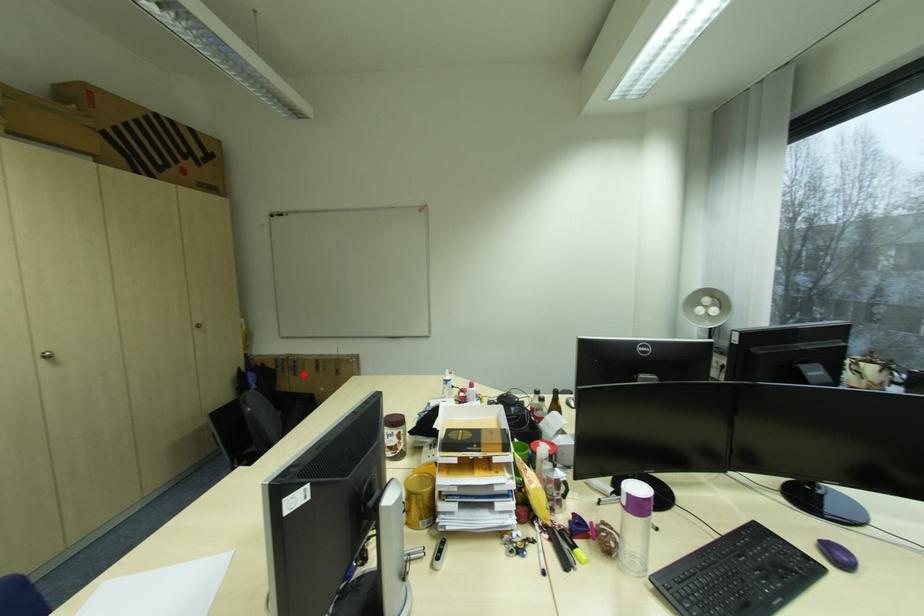
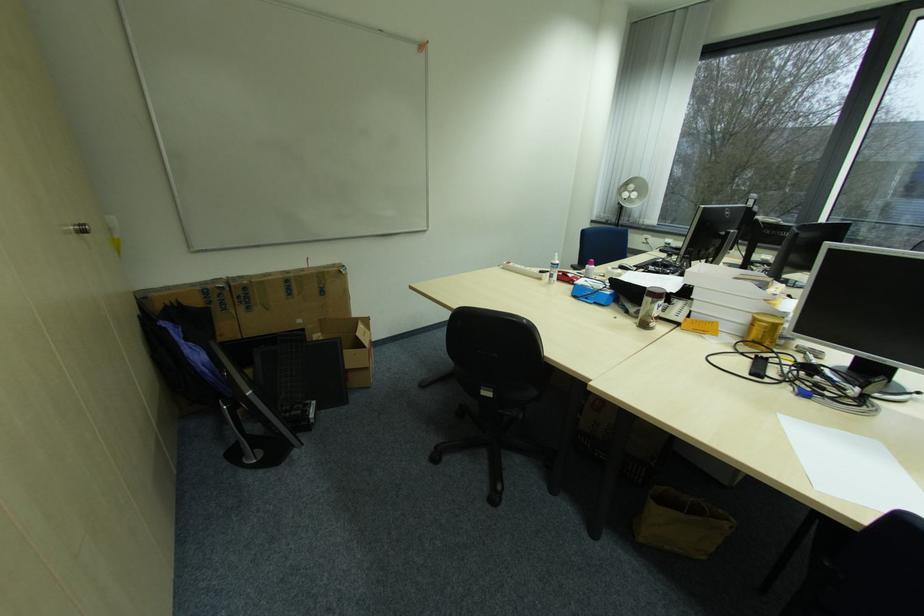
Question: I am providing you with two images of the same scene from different viewpoints. Given a red point in image1, look at the same physical point in image2. Is it:

Choices:
 (A) Closer to the viewpoint
 (B) Farther from the viewpoint

Answer: (A)